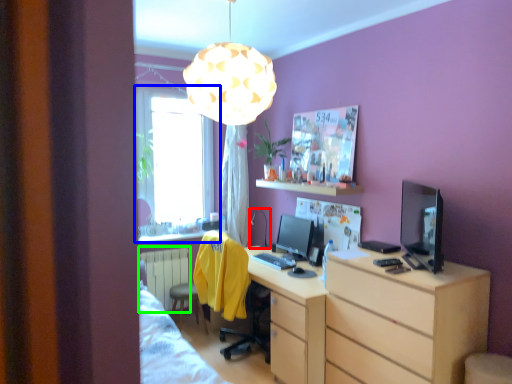
Question: Which object is the farthest from table lamp (highlighted by a red box)? Choose among these: window (highlighted by a blue box) or radiator (highlighted by a green box).

Choices:
 (A) window
 (B) radiator

Answer: (A)